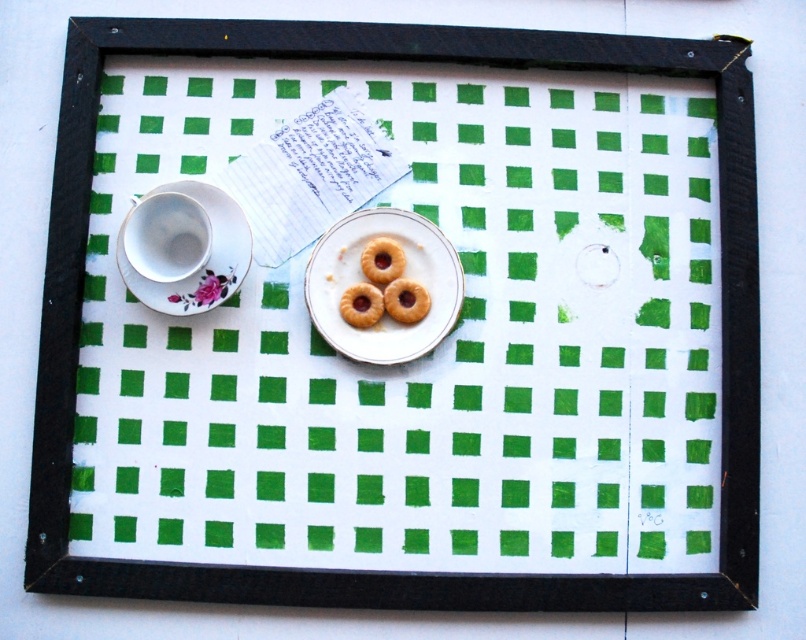
Question: Which object appears closest to the camera in this image?

Choices:
 (A) matte brown cookie at center
 (B) porcelain saucer at left
 (C) golden crispy cookie at center

Answer: (B)

Question: Does porcelain cup at left come in front of matte brown cookie at center?

Choices:
 (A) no
 (B) yes

Answer: (B)

Question: Does white porcelain saucer at center have a lesser width compared to golden matte donut at center?

Choices:
 (A) no
 (B) yes

Answer: (A)

Question: Which point is farther to the camera?

Choices:
 (A) golden crispy cookie at center
 (B) matte brown cookie at center

Answer: (A)

Question: Is porcelain saucer at left closer to camera compared to golden crispy cookie at center?

Choices:
 (A) no
 (B) yes

Answer: (B)

Question: Which point is closer to the camera?

Choices:
 (A) (337, 259)
 (B) (360, 262)
 (C) (177, 228)
 (D) (406, 280)

Answer: (D)